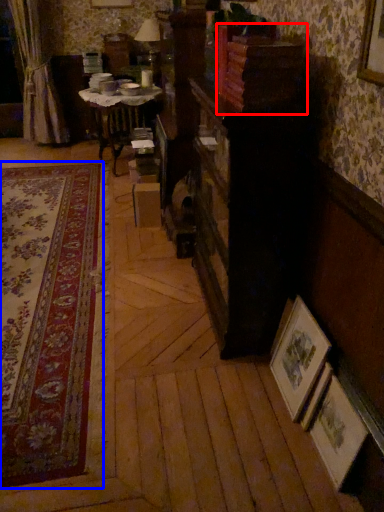
Question: Which point is further to the camera, shelf (highlighted by a red box) or plain (highlighted by a blue box)?

Choices:
 (A) shelf
 (B) plain

Answer: (A)